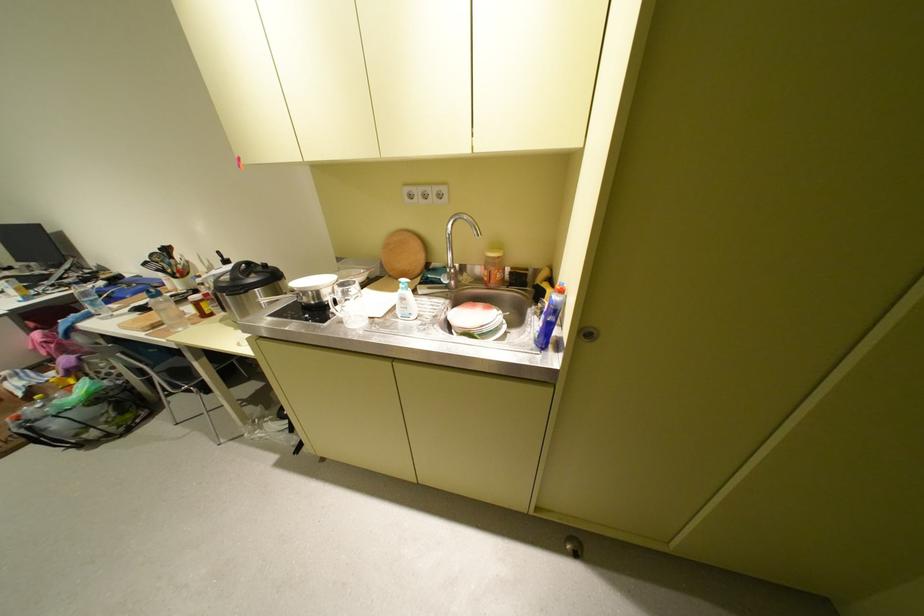
You are a GUI agent. You are given a task and a screenshot of the screen. Output one action in this format:
    pyautogui.click(x=<x>, y=<y>)
    Task: Click on the white bottle pump
    The height and width of the screenshot is (616, 924).
    Given the screenshot: What is the action you would take?
    pyautogui.click(x=402, y=280)